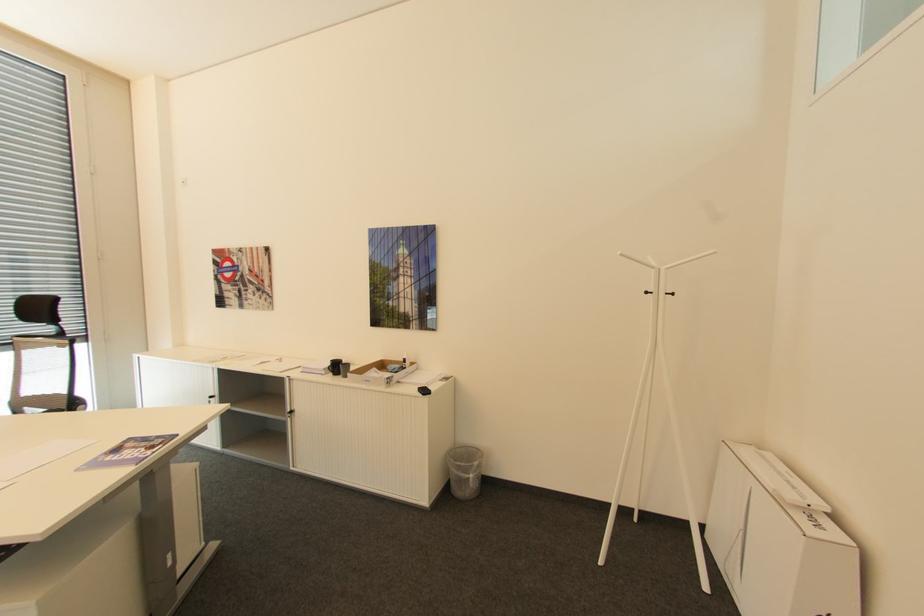
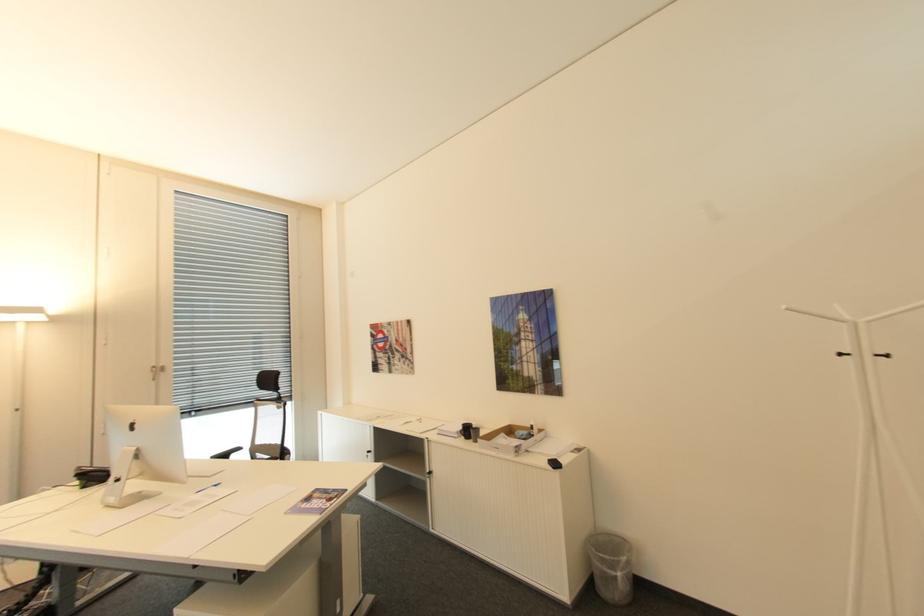
Question: The images are taken continuously from a first-person perspective. In which direction is your viewpoint rotating?

Choices:
 (A) Left
 (B) Right
 (C) Up
 (D) Down

Answer: (A)